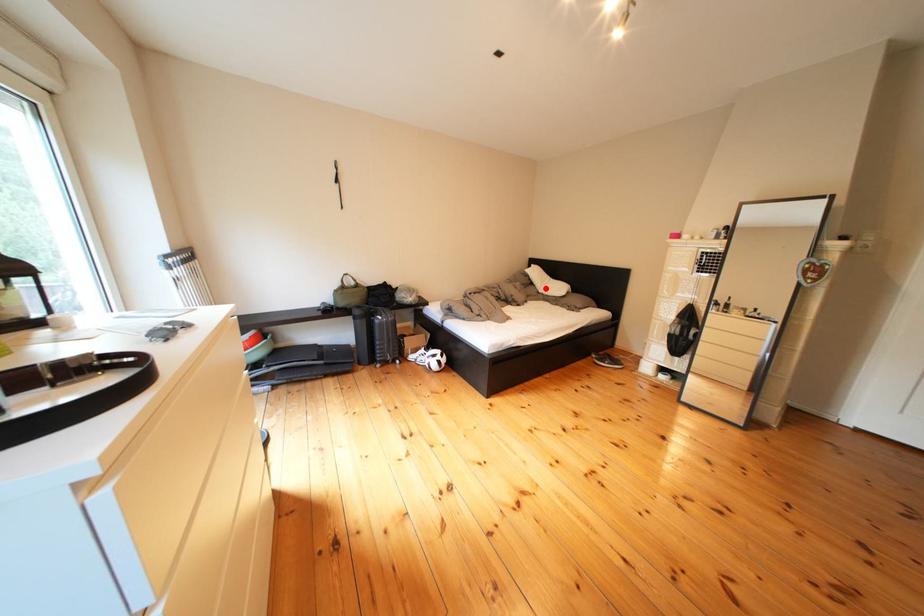
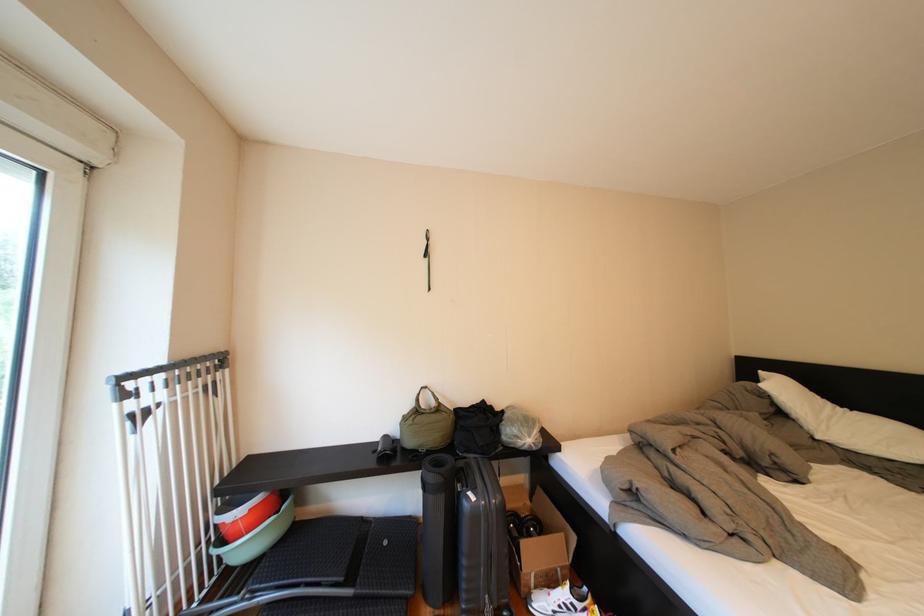
Question: I am providing you with two images of the same scene from different viewpoints. In image1, a red point is highlighted. Considering the same 3D point in image2, which of the following is correct?

Choices:
 (A) It is closer
 (B) It is farther

Answer: (A)